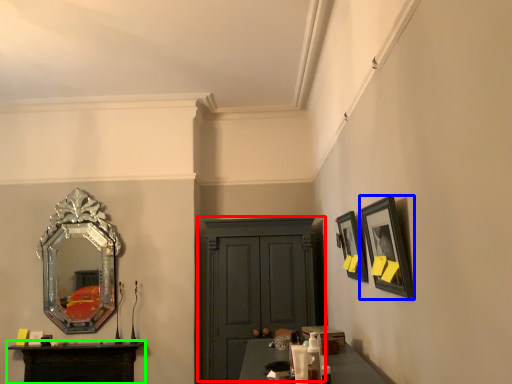
Question: Which object is positioned closest to cabinetry (highlighted by a red box)? Select from picture frame (highlighted by a blue box) and table (highlighted by a green box).

Choices:
 (A) picture frame
 (B) table

Answer: (B)